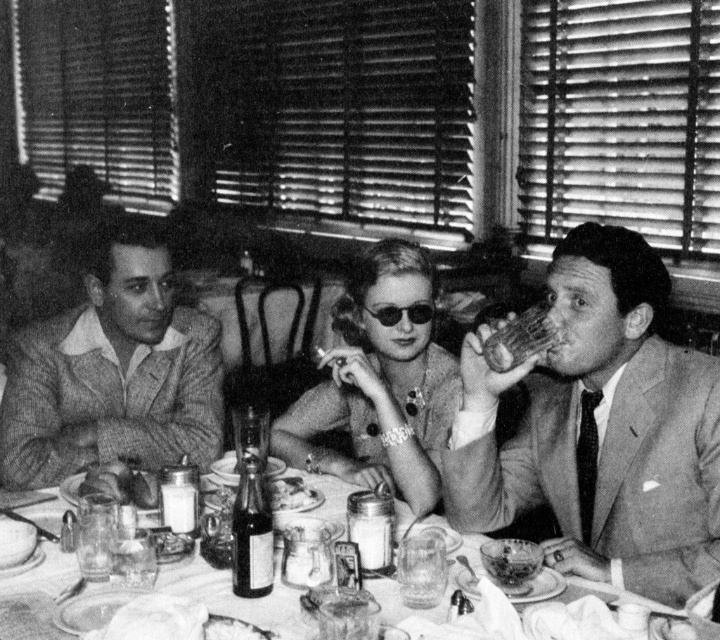
You are a waiter at a restaurant and need to place a new dish on the table. The dish must be placed on the table such that it is between the smooth glass plate at center and the smooth brown bread at center. Is this possible?

The smooth glass plate at center is closer to the viewer than the smooth brown bread at center, so there is space between them. Therefore, placing the dish between the smooth glass plate at center and the smooth brown bread at center is possible.

You are looking at the black and white photograph of the dining table. There are two points marked on the table surface, one at coordinates point (540, 301) and the other at point (109, 480). Which of these two points is nearer to the viewer?

Point (540, 301) is closer to the camera than point (109, 480).